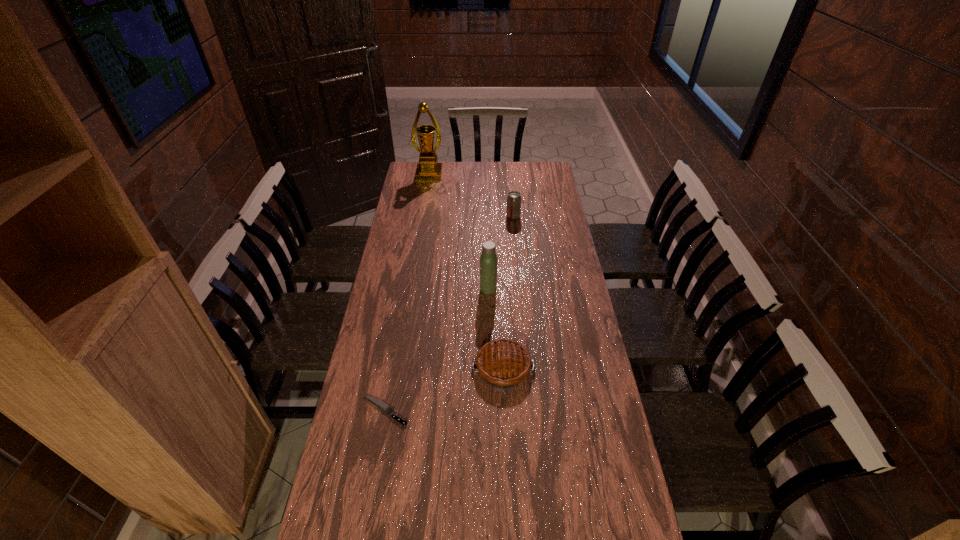
I want to click on free spot at the left edge of the desktop, so click(341, 474).

Where is `blank space at the right edge`? Image resolution: width=960 pixels, height=540 pixels. blank space at the right edge is located at coordinates (533, 189).

Where is `free space between the tallest object and the fourth shortest object`? The image size is (960, 540). free space between the tallest object and the fourth shortest object is located at coordinates (459, 231).

The width and height of the screenshot is (960, 540). What are the coordinates of `free space between the third shortest object and the shortest object` in the screenshot? It's located at (449, 314).

The height and width of the screenshot is (540, 960). In order to click on vacant area between the fourth shortest object and the soda can in this screenshot , I will do `click(501, 253)`.

You are a GUI agent. You are given a task and a screenshot of the screen. Output one action in this format:
    pyautogui.click(x=<x>, y=<y>)
    Task: Click on the empty location between the second nearest object and the farthest object
    This screenshot has width=960, height=540.
    Given the screenshot: What is the action you would take?
    [x=467, y=271]

Locate an element on the screen. The height and width of the screenshot is (540, 960). vacant space that's between the second nearest object and the award is located at coordinates 467,271.

Select which object appears as the second closest to the third shortest object. Please provide its 2D coordinates. Your answer should be formatted as a tuple, i.e. [(x, y)], where the tuple contains the x and y coordinates of a point satisfying the conditions above.

[(428, 169)]

Select which object appears as the second closest to the award. Please provide its 2D coordinates. Your answer should be formatted as a tuple, i.e. [(x, y)], where the tuple contains the x and y coordinates of a point satisfying the conditions above.

[(488, 260)]

Locate an element on the screen. The height and width of the screenshot is (540, 960). blank area in the image that satisfies the following two spatial constraints: 1. on the front-facing side of the soda can; 2. on the right side of the farthest object is located at coordinates (x=422, y=217).